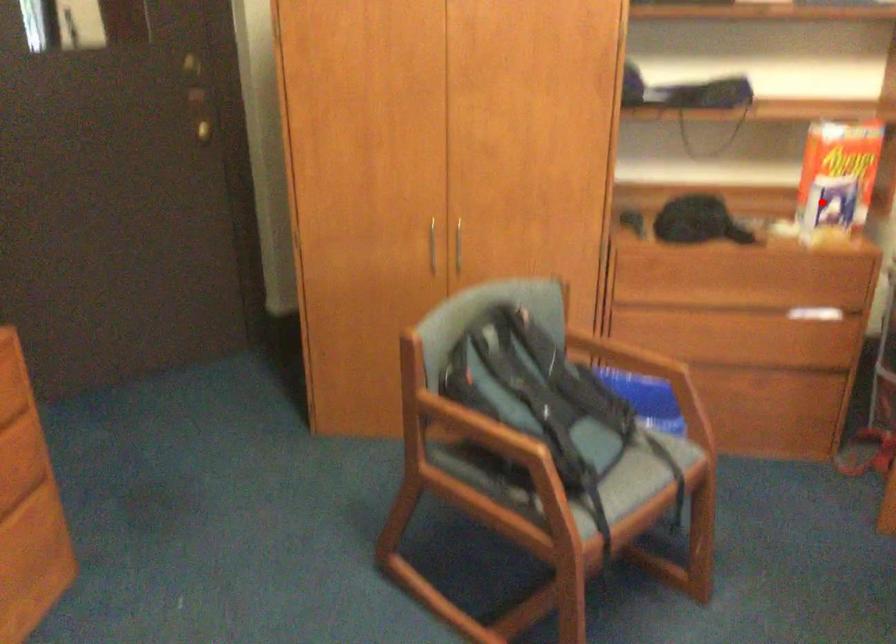
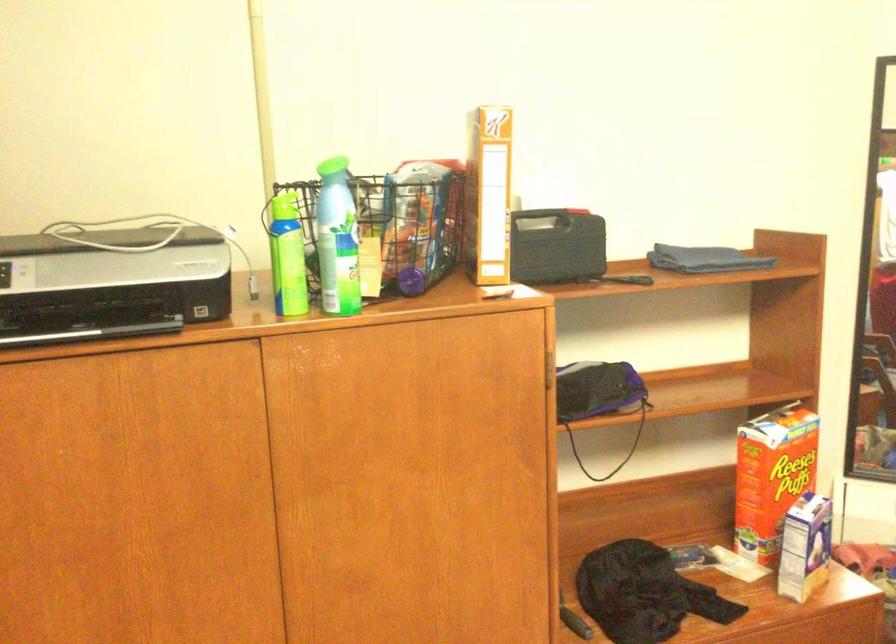
The point at the highlighted location is marked in the first image. Where is the corresponding point in the second image?

(805, 547)